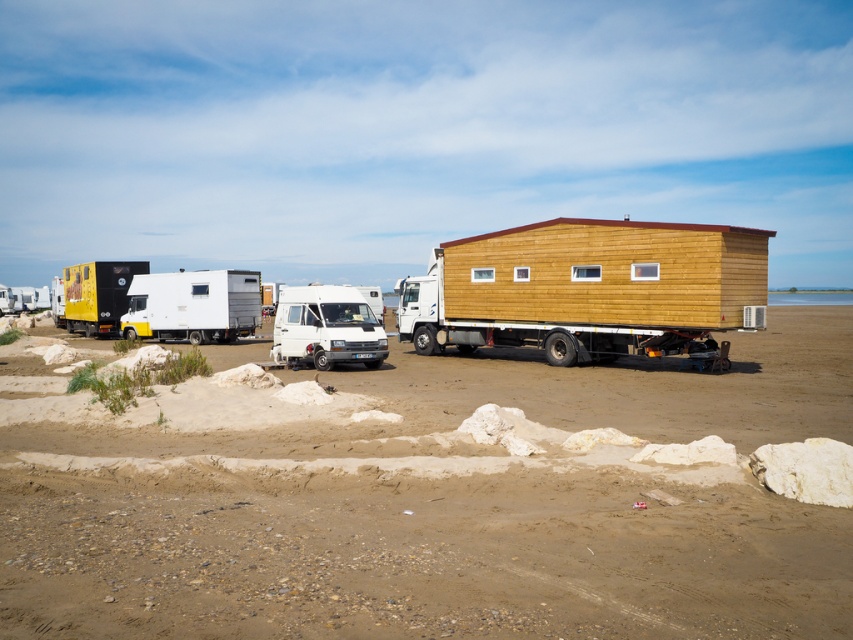
Question: Does white matte van at center have a larger size compared to yellow matte truck at left?

Choices:
 (A) yes
 (B) no

Answer: (B)

Question: Which of the following is the closest to the observer?

Choices:
 (A) (106, 276)
 (B) (276, 532)
 (C) (622, 332)

Answer: (B)

Question: Is wooden cabin at center thinner than white matte truck at center?

Choices:
 (A) yes
 (B) no

Answer: (B)

Question: Which point is closer to the camera?

Choices:
 (A) (321, 308)
 (B) (148, 285)

Answer: (A)

Question: Which object is the farthest from the yellow matte truck at left?

Choices:
 (A) white matte truck at center
 (B) wooden cabin at center
 (C) brown sandy dirt field at lower center

Answer: (C)

Question: Is white matte truck at center positioned in front of white matte van at center?

Choices:
 (A) yes
 (B) no

Answer: (B)